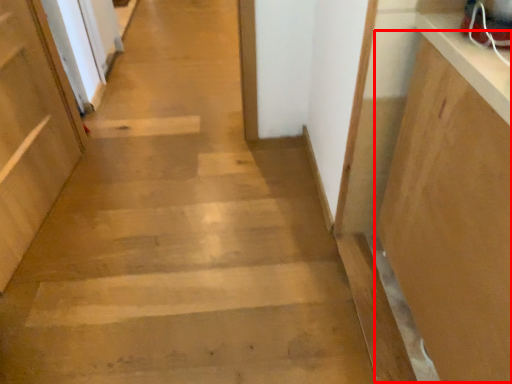
Question: Observing the image, what is the correct spatial positioning of cabinetry (annotated by the red box) in reference to door?

Choices:
 (A) right
 (B) left

Answer: (A)